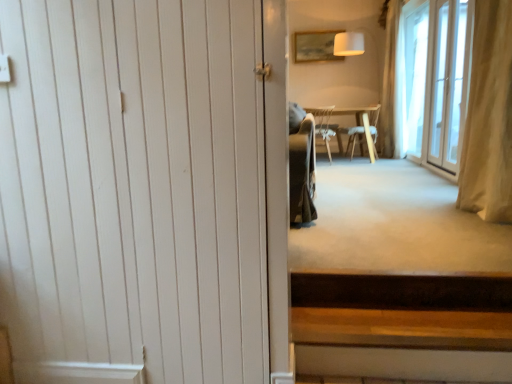
Question: In terms of height, does beige fabric curtain at right, which is the first curtain from left to right, look taller or shorter compared to matte wooden picture frame at upper center?

Choices:
 (A) tall
 (B) short

Answer: (A)

Question: Looking at the image, does beige fabric curtain at right, which is the first curtain from left to right, seem bigger or smaller compared to matte wooden picture frame at upper center?

Choices:
 (A) big
 (B) small

Answer: (A)

Question: Which of these objects is positioned farthest from the beige fabric curtain at right, acting as the second curtain starting from the back?

Choices:
 (A) transparent glass door at right
 (B) matte gray chair at center, placed as the 1th chair when sorted from left to right
 (C) white wood door at left
 (D) light brown wooden chair at center, positioned as the second chair in left-to-right order
 (E) wooden stairs at lower right

Answer: (D)

Question: Considering the real-world distances, which object is farthest from the wooden stairs at lower right?

Choices:
 (A) white sheer curtain at right, marked as the 2th curtain in a left-to-right arrangement
 (B) transparent glass door at right
 (C) light brown wooden chair at center, the first chair viewed from the right
 (D) matte wooden picture frame at upper center
 (E) white wood door at left

Answer: (D)